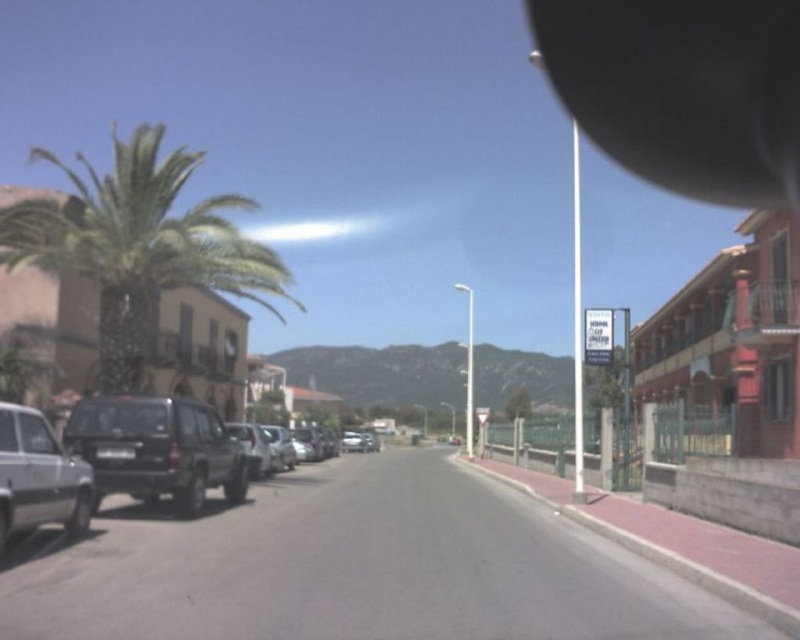
Does green leafy palm tree at left have a greater width compared to silver metallic suv at left?

Correct, the width of green leafy palm tree at left exceeds that of silver metallic suv at left.

Between green leafy palm tree at left and silver metallic suv at left, which one appears on the left side from the viewer's perspective?

green leafy palm tree at left

Who is more distant from viewer, (216, 257) or (193, 440)?

The point (216, 257) is behind.

Locate an element on the screen. Image resolution: width=800 pixels, height=640 pixels. green leafy palm tree at left is located at coordinates (138, 243).

Based on the photo, who is shorter, silver metallic car at left or black plastic license plate at center?

Standing shorter between the two is black plastic license plate at center.

Which is behind, point (18, 518) or point (113, 451)?

The point (113, 451) is behind.

This screenshot has height=640, width=800. I want to click on silver metallic car at left, so click(38, 476).

Which is above, dark gray matte suv at center-left or black plastic license plate at center?

Positioned higher is black plastic license plate at center.

Can you confirm if dark gray matte suv at center-left is positioned below black plastic license plate at center?

Yes.

Who is more distant from viewer, (x=218, y=449) or (x=134, y=451)?

Point (x=218, y=449)

The height and width of the screenshot is (640, 800). Find the location of `dark gray matte suv at center-left`. dark gray matte suv at center-left is located at coordinates (158, 449).